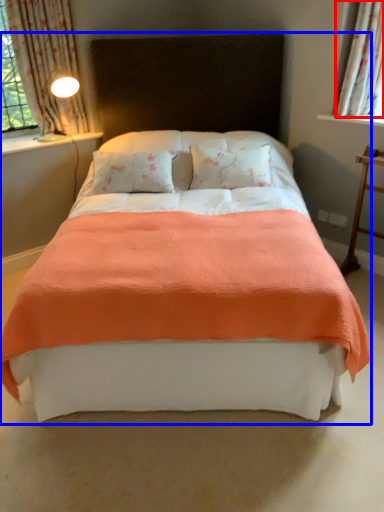
Question: Which point is closer to the camera, curtain (highlighted by a red box) or bed (highlighted by a blue box)?

Choices:
 (A) curtain
 (B) bed

Answer: (B)